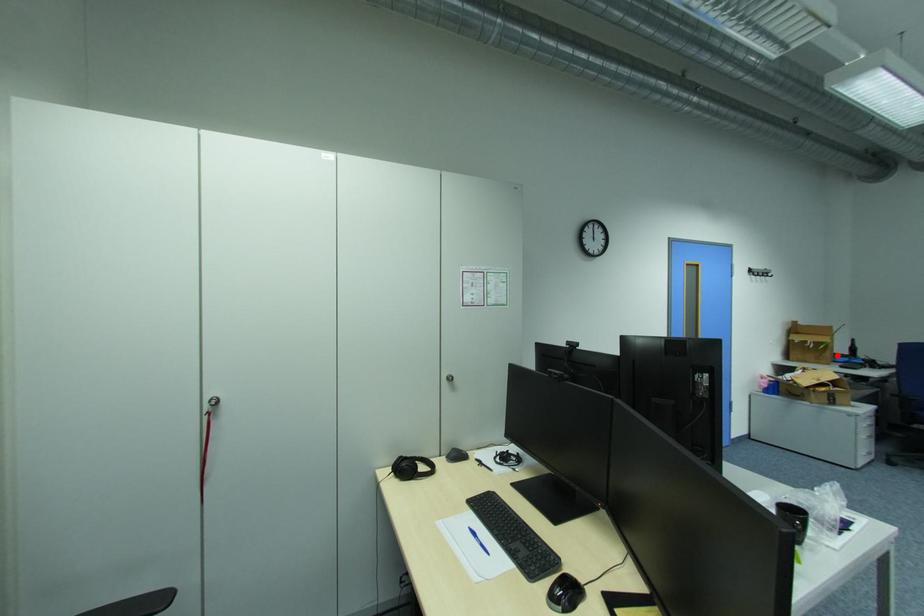
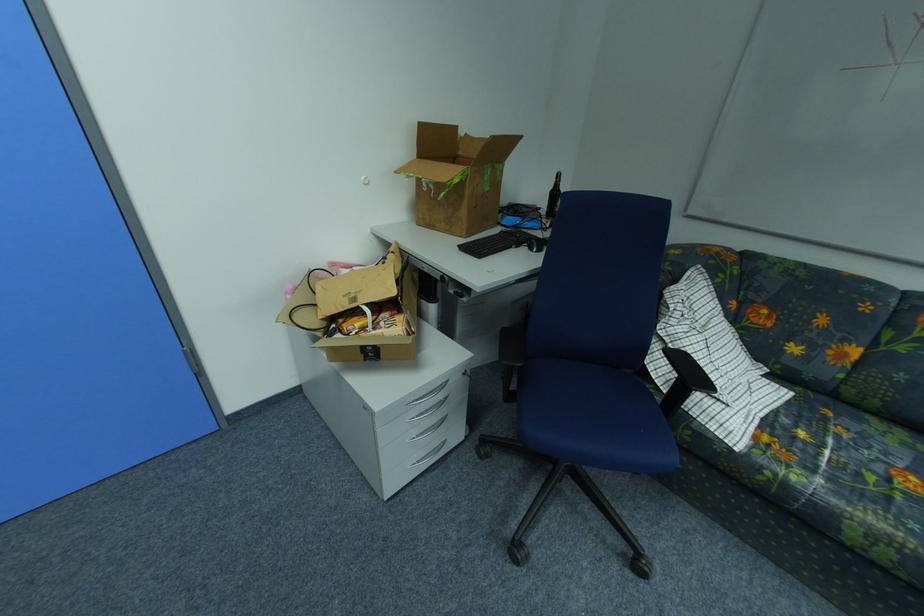
In the second image, find the point that corresponds to the highlighted location in the first image.

(470, 214)